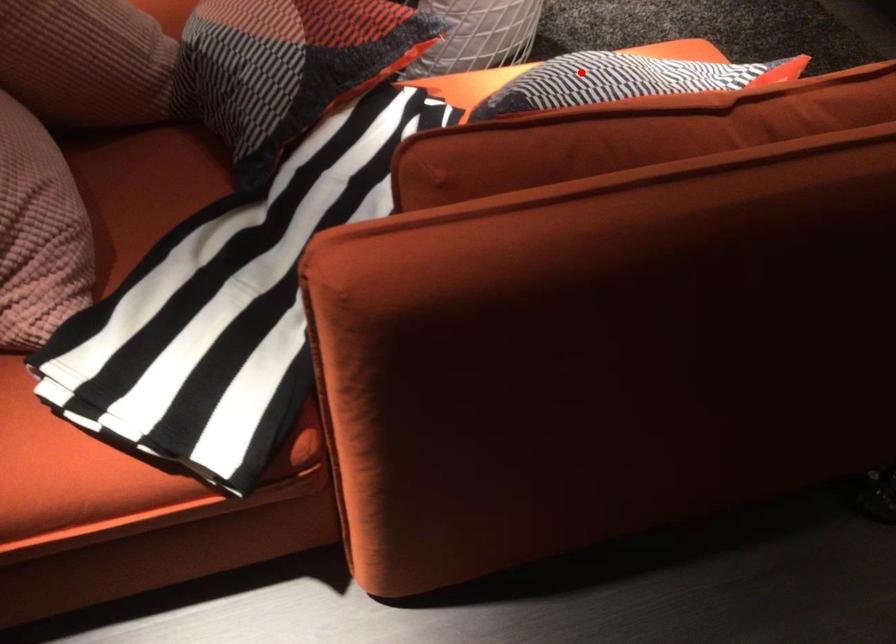
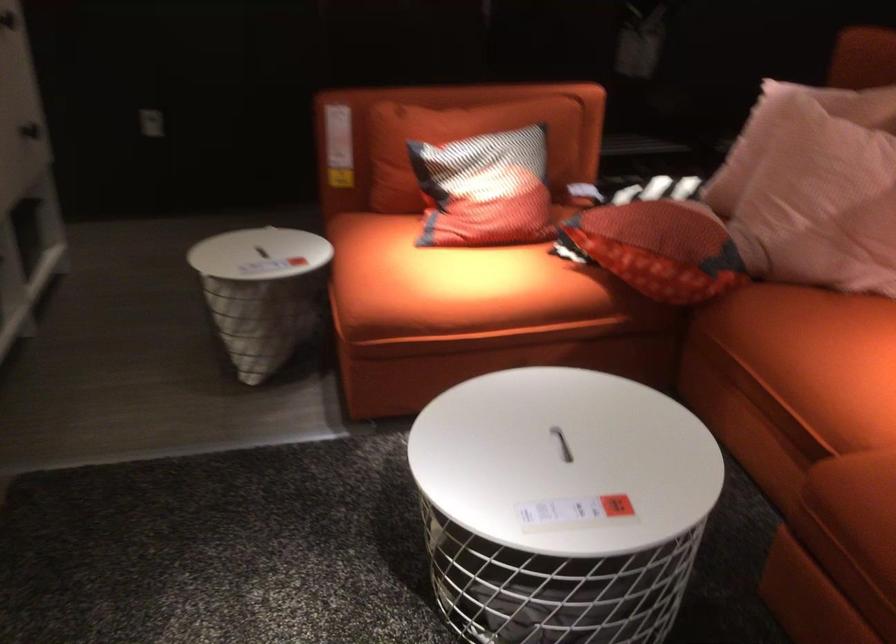
Question: I am providing you with two images of the same scene from different viewpoints. A red point is shown in image1. For the corresponding object point in image2, is it positioned nearer or farther from the camera?

Choices:
 (A) Nearer
 (B) Farther

Answer: (B)